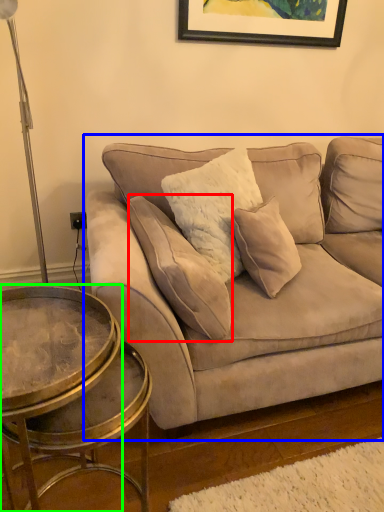
Question: Estimate the real-world distances between objects in this image. Which object is closer to pillow (highlighted by a red box), studio couch (highlighted by a blue box) or coffee table (highlighted by a green box)?

Choices:
 (A) studio couch
 (B) coffee table

Answer: (A)